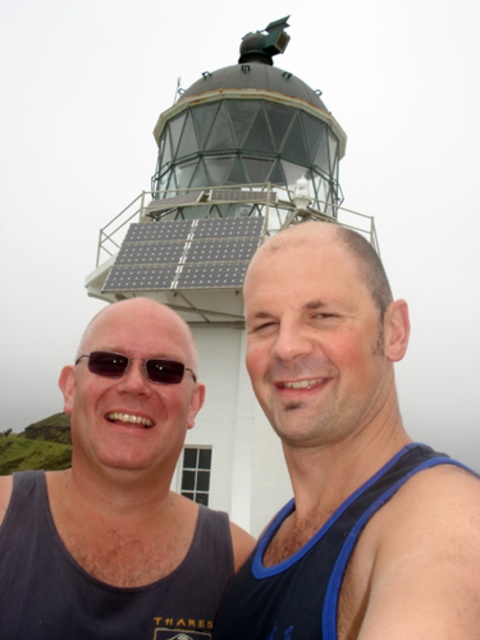
Question: Can you confirm if metallic lighthouse at upper center is positioned to the left of dark gray tank top at left?

Choices:
 (A) no
 (B) yes

Answer: (A)

Question: Which point is farther from the camera taking this photo?

Choices:
 (A) (96, 358)
 (B) (163, 129)

Answer: (B)

Question: Which object appears farthest from the camera in this image?

Choices:
 (A) black matte sunglasses at left
 (B) black fabric tank top at center
 (C) metallic lighthouse at upper center

Answer: (C)

Question: Does metallic lighthouse at upper center appear on the left side of black matte sunglasses at left?

Choices:
 (A) no
 (B) yes

Answer: (A)

Question: Which object appears farthest from the camera in this image?

Choices:
 (A) metallic lighthouse at upper center
 (B) black fabric tank top at center
 (C) black matte sunglasses at left
 (D) dark gray tank top at left

Answer: (A)

Question: Is metallic lighthouse at upper center wider than dark gray tank top at left?

Choices:
 (A) no
 (B) yes

Answer: (B)